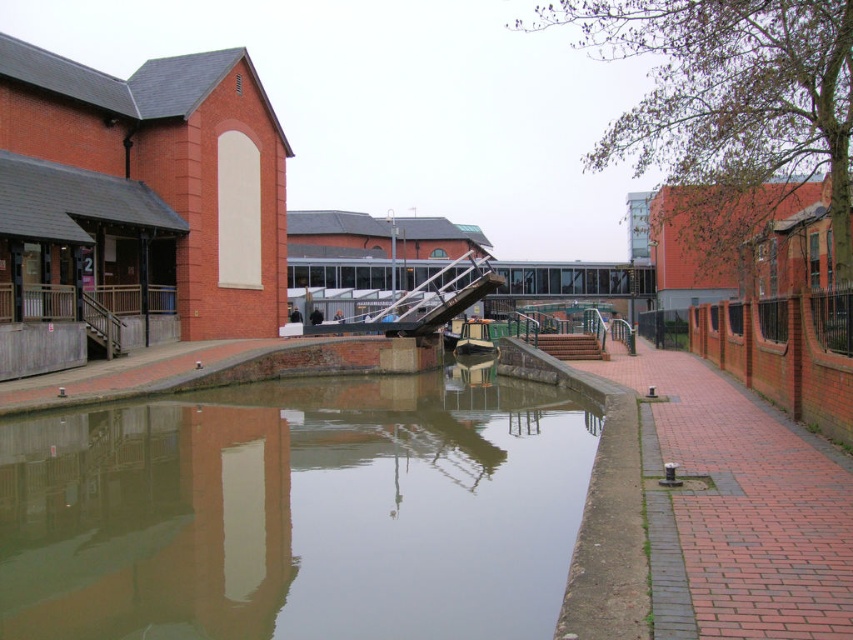
Image resolution: width=853 pixels, height=640 pixels. What are the coordinates of `smooth concrete water at center` in the screenshot? It's located at (x=297, y=512).

Is point (149, 561) farther from viewer compared to point (468, 317)?

No, (149, 561) is closer to viewer.

Find the location of a particular element. smooth concrete water at center is located at coordinates (297, 512).